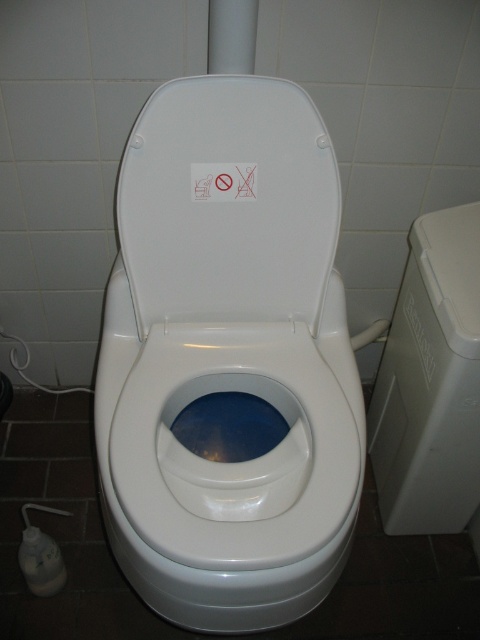
Who is lower down, white glossy toilet lid at center or white plastic trash can at right?

white plastic trash can at right is lower down.

Who is shorter, white glossy toilet lid at center or white plastic trash can at right?

With less height is white glossy toilet lid at center.

This screenshot has width=480, height=640. Identify the location of white glossy toilet lid at center. 228,204.